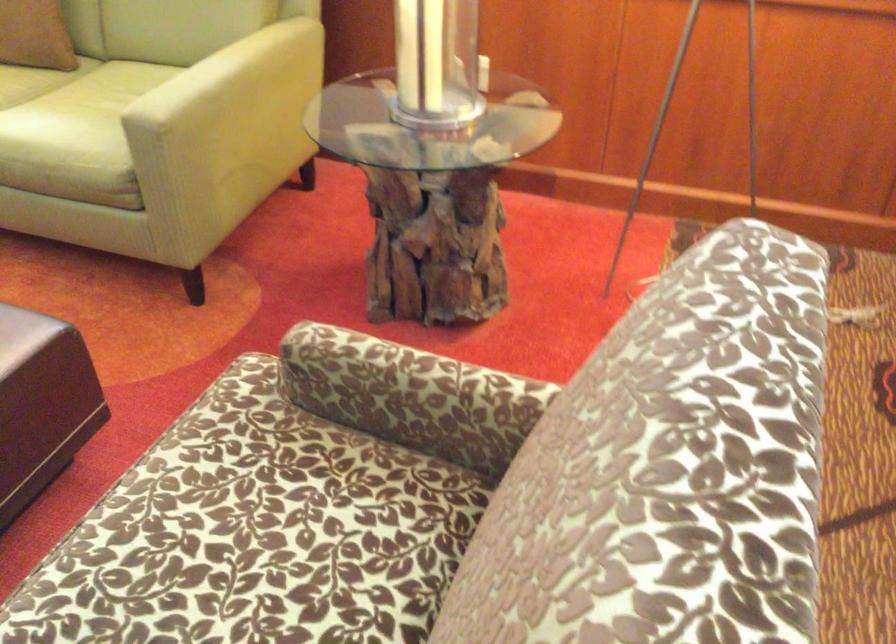
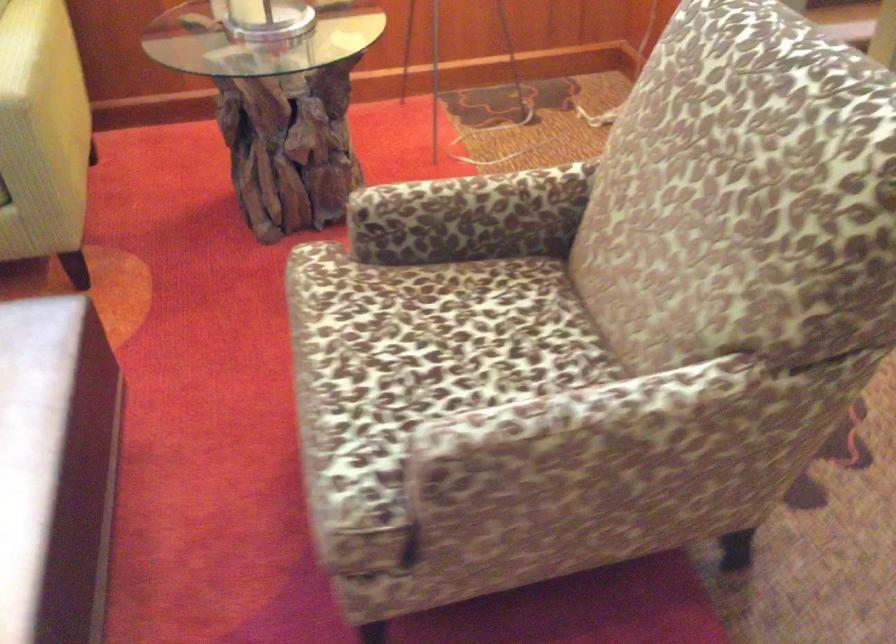
Locate, in the second image, the point that corresponds to pixel 401 401 in the first image.

(471, 216)